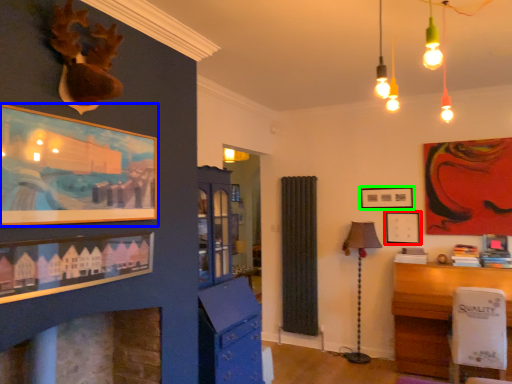
Question: Which object is the closest to the picture frame (highlighted by a red box)? Choose among these: picture frame (highlighted by a blue box) or picture frame (highlighted by a green box).

Choices:
 (A) picture frame
 (B) picture frame

Answer: (B)